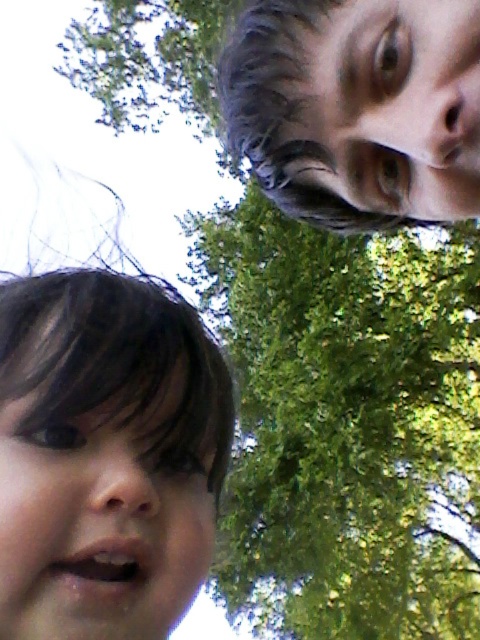
Who is more forward, (147, 634) or (376, 77)?

Point (147, 634) is more forward.

Between smooth skin face at bottom left and smooth skin face at upper right, which one is positioned higher?

smooth skin face at upper right is higher up.

The image size is (480, 640). Describe the element at coordinates (106, 456) in the screenshot. I see `smooth skin face at bottom left` at that location.

In order to click on smooth skin face at bottom left in this screenshot , I will do `click(106, 456)`.